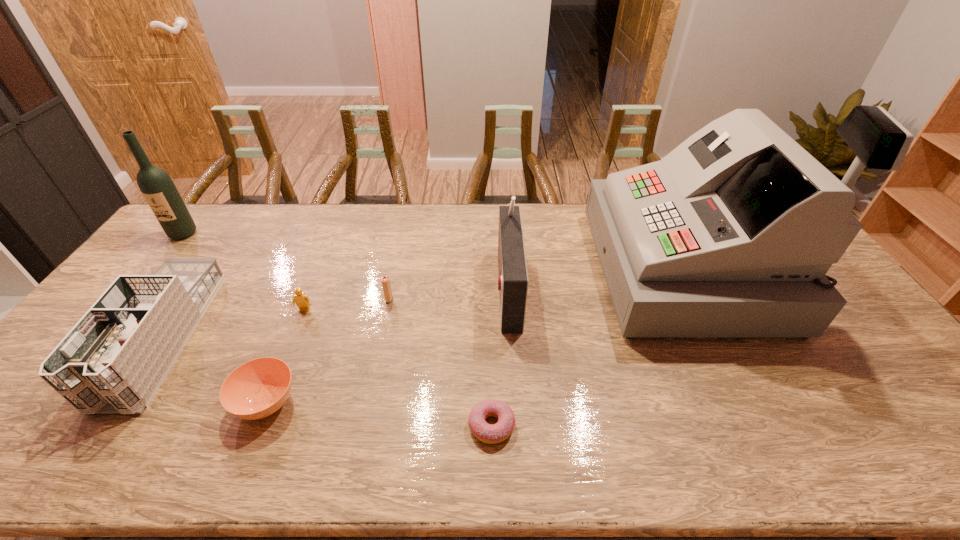
Identify the location of the shortest object. (491, 434).

Locate an element on the screen. The width and height of the screenshot is (960, 540). vacant space located on the keypad side of the rightmost object is located at coordinates (491, 269).

Where is `vacant space located 0.200m on the keypad side of the rightmost object`? This screenshot has height=540, width=960. vacant space located 0.200m on the keypad side of the rightmost object is located at coordinates (537, 269).

Locate an element on the screen. The height and width of the screenshot is (540, 960). free space located 0.120m on the keypad side of the rightmost object is located at coordinates (562, 269).

Identify the location of vacant space positioned on the labeled side of the wine bottle. (141, 286).

What are the coordinates of `vacant point located 0.360m on the front panel of the sixth shortest object` in the screenshot? It's located at (378, 287).

Image resolution: width=960 pixels, height=540 pixels. In order to click on vacant point located on the front panel of the sixth shortest object in this screenshot , I will do `click(469, 287)`.

Where is `free space located 0.230m on the front panel of the sixth shortest object`? The image size is (960, 540). free space located 0.230m on the front panel of the sixth shortest object is located at coordinates coord(420,287).

In order to click on vacant space located 0.120m on the right of the fourth object from right to left in this screenshot , I will do `click(432, 299)`.

Identify the location of vacant space situated 0.120m on the face of the Lego. (290, 347).